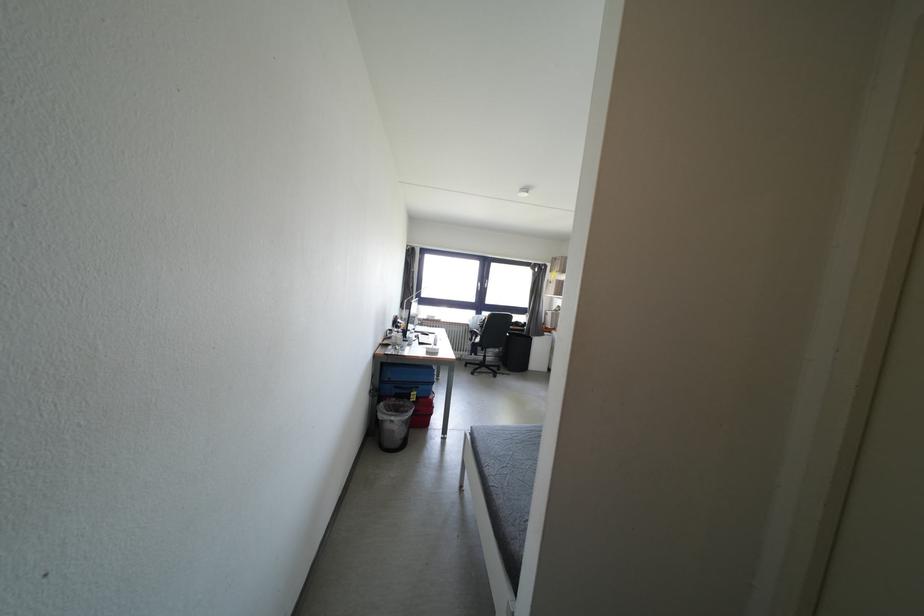
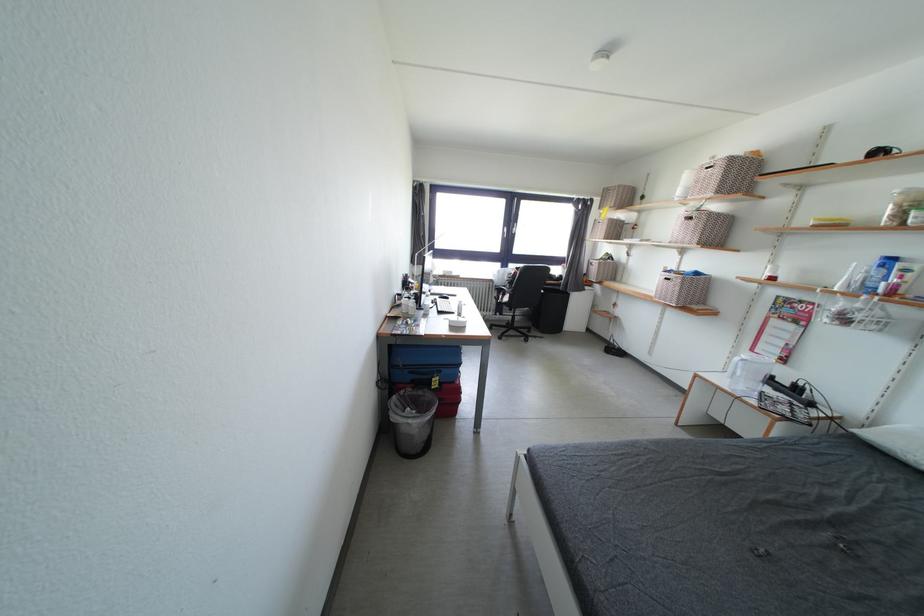
Find the pixel in the second image that matches (x=544, y=331) in the first image.

(584, 284)